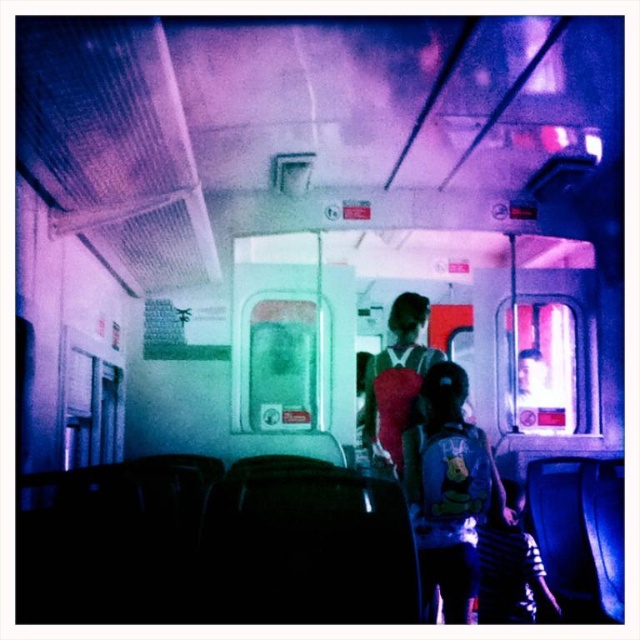
Question: Is the position of matte blue backpack at center less distant than that of matte pink backpack at center?

Choices:
 (A) no
 (B) yes

Answer: (B)

Question: Is matte blue backpack at center above matte pink backpack at center?

Choices:
 (A) yes
 (B) no

Answer: (B)

Question: Is matte blue backpack at center wider than matte pink backpack at center?

Choices:
 (A) yes
 (B) no

Answer: (A)

Question: Which point is farther to the camera?

Choices:
 (A) matte blue backpack at center
 (B) matte pink backpack at center

Answer: (B)

Question: Which point is farther to the camera?

Choices:
 (A) (477, 536)
 (B) (406, 292)

Answer: (B)